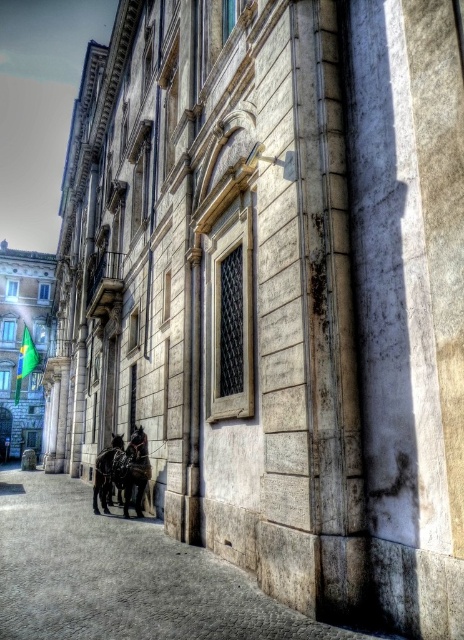
You are standing in front of the historic building and notice two points marked on its facade. The first point is at coordinates point (211,573) and the second is at point (121,465). Which of these points is closer to you?

Point (211,573) is in front of point (121,465), so it is closer to you.

You are a delivery person with a cart that is 2 meters wide. You need to navigate through the space between the stone textured alley at lower left and the shiny black horse at center. Can your cart fit through this space?

The distance between the stone textured alley at lower left and the shiny black horse at center is 4.71 meters. Since your cart is only 2 meters wide, it can easily fit through the space between them.

You are standing in front of the historic building and see the stone textured alley at lower left and the shiny black horse at lower left. Which object is located more to the left?

The stone textured alley at lower left is positioned on the left side of the shiny black horse at lower left, so the stone textured alley at lower left is more to the left.